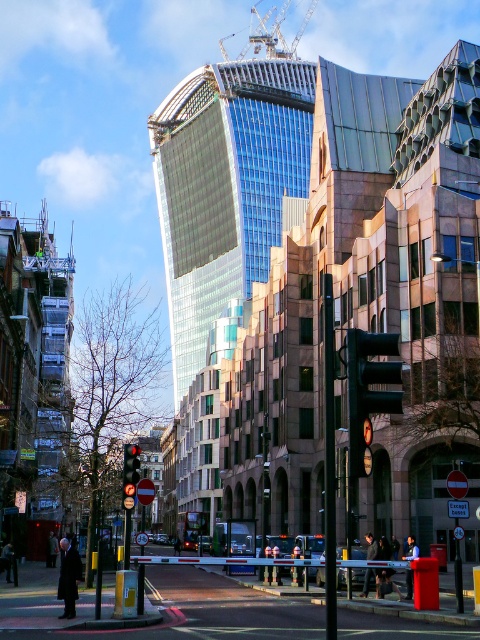
Question: Does glassy reflective skyscraper at center have a lesser width compared to metallic construction crane at upper center?

Choices:
 (A) no
 (B) yes

Answer: (A)

Question: Which of these objects is positioned closest to the glassy reflective skyscraper at center?

Choices:
 (A) metallic construction crane at upper center
 (B) red glass traffic light at center

Answer: (A)

Question: Does glassy reflective skyscraper at center appear under metallic construction crane at upper center?

Choices:
 (A) yes
 (B) no

Answer: (A)

Question: Which point is farther from the camera taking this photo?

Choices:
 (A) (365, 380)
 (B) (133, 468)

Answer: (B)

Question: Which object appears farthest from the camera in this image?

Choices:
 (A) metallic construction crane at upper center
 (B) glassy reflective skyscraper at center
 (C) red glass traffic light at center

Answer: (A)

Question: Is green matte traffic light at center smaller than metallic construction crane at upper center?

Choices:
 (A) no
 (B) yes

Answer: (B)